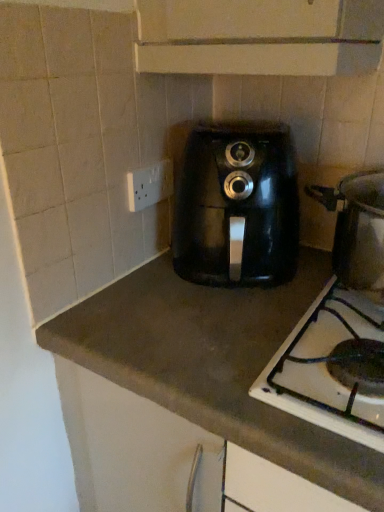
Describe the element at coordinates (149, 185) in the screenshot. I see `white plastic socket at upper left` at that location.

This screenshot has width=384, height=512. Describe the element at coordinates (215, 362) in the screenshot. I see `brown matte countertop at center` at that location.

Find the location of `black matte gas stove at lower right`. black matte gas stove at lower right is located at coordinates (325, 369).

Find the location of `black plastic air fryer at center`. black plastic air fryer at center is located at coordinates pyautogui.click(x=237, y=207).

How far apart are black matte gas stove at lower right and brown matte countertop at center?

black matte gas stove at lower right is 4.48 inches away from brown matte countertop at center.

From a real-world perspective, is black matte gas stove at lower right above or below brown matte countertop at center?

black matte gas stove at lower right is above brown matte countertop at center.

In terms of height, does black matte gas stove at lower right look taller or shorter compared to brown matte countertop at center?

black matte gas stove at lower right is shorter than brown matte countertop at center.

Which point is more distant from viewer, (312, 405) or (50, 321)?

Positioned behind is point (50, 321).

Locate an element on the screen. This screenshot has width=384, height=512. gas stove that is on the right side of black plastic air fryer at center is located at coordinates (325, 369).

Is point (230, 222) positioned after point (314, 394)?

Yes.

Can you confirm if black plastic air fryer at center is shorter than black matte gas stove at lower right?

Indeed, black plastic air fryer at center has a lesser height compared to black matte gas stove at lower right.

Is point (127, 178) farther from camera compared to point (325, 323)?

Yes, point (127, 178) is farther from viewer.

Is white plastic socket at upper left looking in the opposite direction of black matte gas stove at lower right?

That's not correct — white plastic socket at upper left is not looking away from black matte gas stove at lower right.

Considering the sizes of objects white plastic socket at upper left and black matte gas stove at lower right in the image provided, who is bigger, white plastic socket at upper left or black matte gas stove at lower right?

Bigger between the two is black matte gas stove at lower right.

Which is more to the left, white plastic socket at upper left or black matte gas stove at lower right?

From the viewer's perspective, white plastic socket at upper left appears more on the left side.

From the image's perspective, is brown matte countertop at center on white plastic socket at upper left?

Incorrect, from the image's perspective, brown matte countertop at center is lower than white plastic socket at upper left.

In the image, is brown matte countertop at center positioned in front of or behind white plastic socket at upper left?

brown matte countertop at center is positioned closer to the viewer than white plastic socket at upper left.

Is brown matte countertop at center aimed at white plastic socket at upper left?

No, brown matte countertop at center is not facing towards white plastic socket at upper left.

From a real-world perspective, is brown matte countertop at center under black plastic air fryer at center?

Yes, from a real-world perspective, brown matte countertop at center is below black plastic air fryer at center.

Looking at this image, who is bigger, brown matte countertop at center or black plastic air fryer at center?

brown matte countertop at center.

Between brown matte countertop at center and black plastic air fryer at center, which one appears on the right side from the viewer's perspective?

From the viewer's perspective, black plastic air fryer at center appears more on the right side.

From the image's perspective, is brown matte countertop at center located beneath black plastic air fryer at center?

Correct, brown matte countertop at center appears lower than black plastic air fryer at center in the image.

Identify the location of home appliance on the right of brown matte countertop at center. (237, 207).

Considering the sizes of objects black plastic air fryer at center and brown matte countertop at center in the image provided, who is bigger, black plastic air fryer at center or brown matte countertop at center?

brown matte countertop at center is bigger.

Can you confirm if black plastic air fryer at center is shorter than brown matte countertop at center?

Correct, black plastic air fryer at center is not as tall as brown matte countertop at center.

From a real-world perspective, is black plastic air fryer at center physically above brown matte countertop at center?

Yes.

Measure the distance from white plastic socket at upper left to black plastic air fryer at center.

They are 7.67 inches apart.

This screenshot has width=384, height=512. Identify the location of home appliance located in front of the white plastic socket at upper left. (237, 207).

Does white plastic socket at upper left have a greater height compared to black plastic air fryer at center?

No, white plastic socket at upper left is not taller than black plastic air fryer at center.

Is the depth of white plastic socket at upper left less than that of black plastic air fryer at center?

No, white plastic socket at upper left is further to the viewer.

This screenshot has height=512, width=384. I want to click on gas stove below the brown matte countertop at center (from the image's perspective), so click(x=325, y=369).

Identify the location of gas stove that is under the black plastic air fryer at center (from a real-world perspective). This screenshot has height=512, width=384. (325, 369).

Based on the photo, based on their spatial positions, is black matte gas stove at lower right or black plastic air fryer at center further from white plastic socket at upper left?

Based on the image, black matte gas stove at lower right appears to be further to white plastic socket at upper left.

Which object lies further to the anchor point black matte gas stove at lower right, brown matte countertop at center or black plastic air fryer at center?

black plastic air fryer at center is further to black matte gas stove at lower right.

Estimate the real-world distances between objects in this image. Which object is closer to white plastic socket at upper left, black plastic air fryer at center or brown matte countertop at center?

black plastic air fryer at center.

Based on their spatial positions, is black matte gas stove at lower right or brown matte countertop at center closer to white plastic socket at upper left?

Among the two, brown matte countertop at center is located nearer to white plastic socket at upper left.

Based on their spatial positions, is black matte gas stove at lower right or white plastic socket at upper left further from brown matte countertop at center?

The object further to brown matte countertop at center is white plastic socket at upper left.

Which object lies further to the anchor point brown matte countertop at center, black matte gas stove at lower right or black plastic air fryer at center?

Among the two, black plastic air fryer at center is located further to brown matte countertop at center.

Based on their spatial positions, is brown matte countertop at center or white plastic socket at upper left closer to black plastic air fryer at center?

brown matte countertop at center.

Which object lies nearer to the anchor point brown matte countertop at center, white plastic socket at upper left or black matte gas stove at lower right?

black matte gas stove at lower right is positioned closer to the anchor brown matte countertop at center.

Locate an element on the screen. This screenshot has width=384, height=512. countertop between white plastic socket at upper left and black matte gas stove at lower right from top to bottom is located at coordinates 215,362.

Identify the location of home appliance between white plastic socket at upper left and black matte gas stove at lower right vertically. (237, 207).

The image size is (384, 512). I want to click on countertop between black plastic air fryer at center and black matte gas stove at lower right in the vertical direction, so click(x=215, y=362).

This screenshot has height=512, width=384. I want to click on home appliance between white plastic socket at upper left and brown matte countertop at center from top to bottom, so click(237, 207).